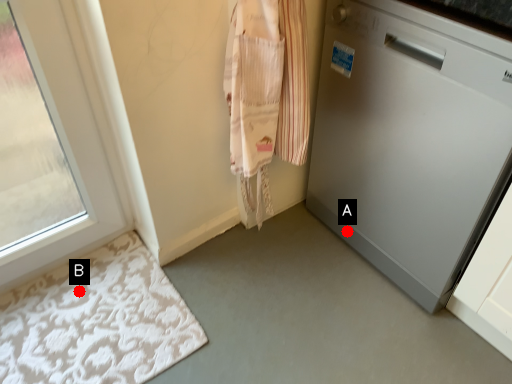
Question: Two points are circled on the image, labeled by A and B beside each circle. Among these points, which one is nearest to the camera?

Choices:
 (A) A is closer
 (B) B is closer

Answer: (B)